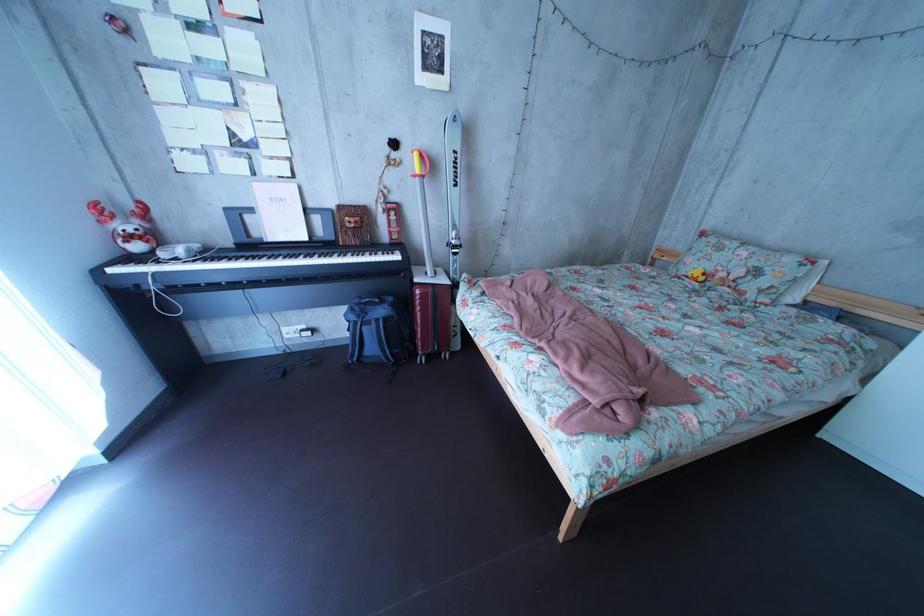
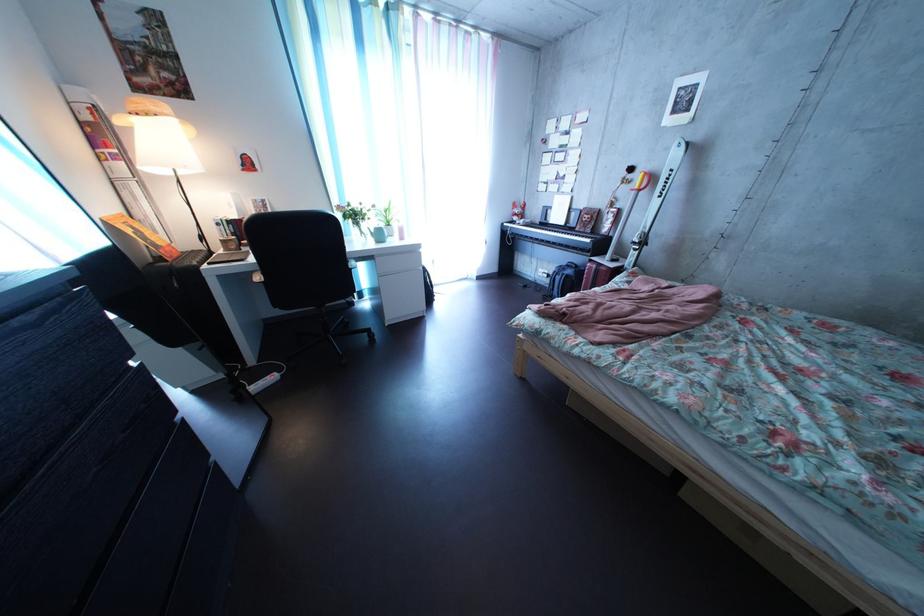
The point at (321, 246) is marked in the first image. Where is the corresponding point in the second image?

(577, 232)